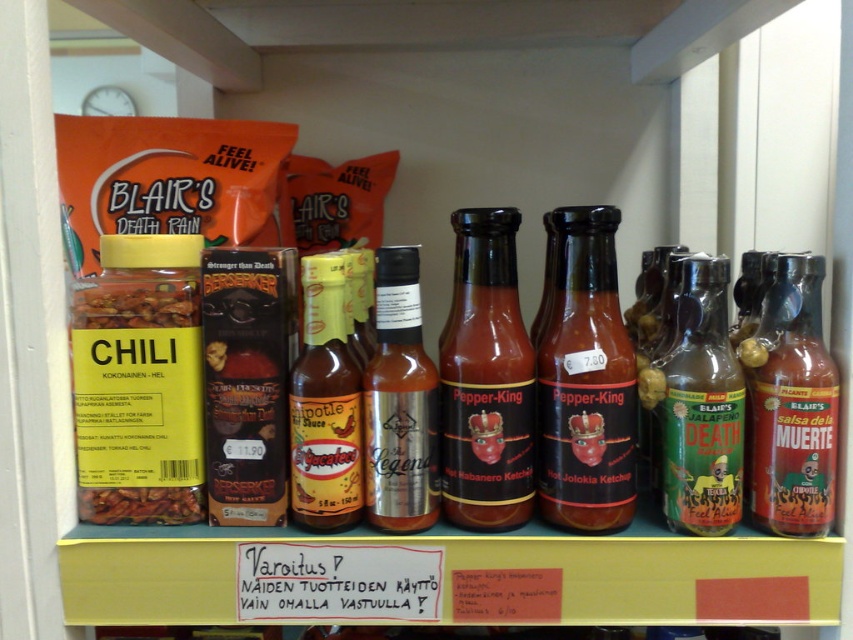
You are a store employee who needs to restock the shelf. You have a new box of yellow matte hot sauce at center and a translucent glass bottle at center right. According to the current arrangement, where should you place each item to maintain the existing order?

The yellow matte hot sauce at center should be placed above the translucent glass bottle at center right since the bottle is currently positioned below the sauce in the existing arrangement.